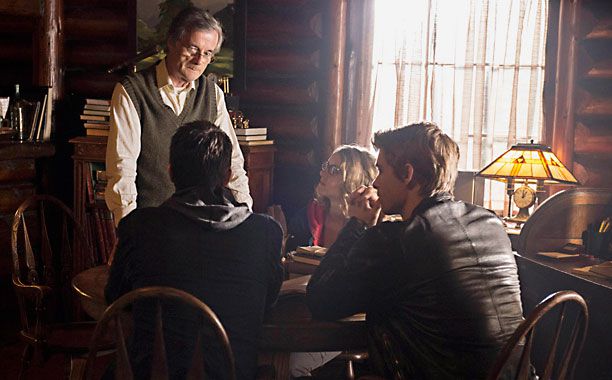
You are a GUI agent. You are given a task and a screenshot of the screen. Output one action in this format:
    pyautogui.click(x=<x>, y=<y>)
    Task: Click on the clock
    
    Given the screenshot: What is the action you would take?
    pyautogui.click(x=520, y=195)